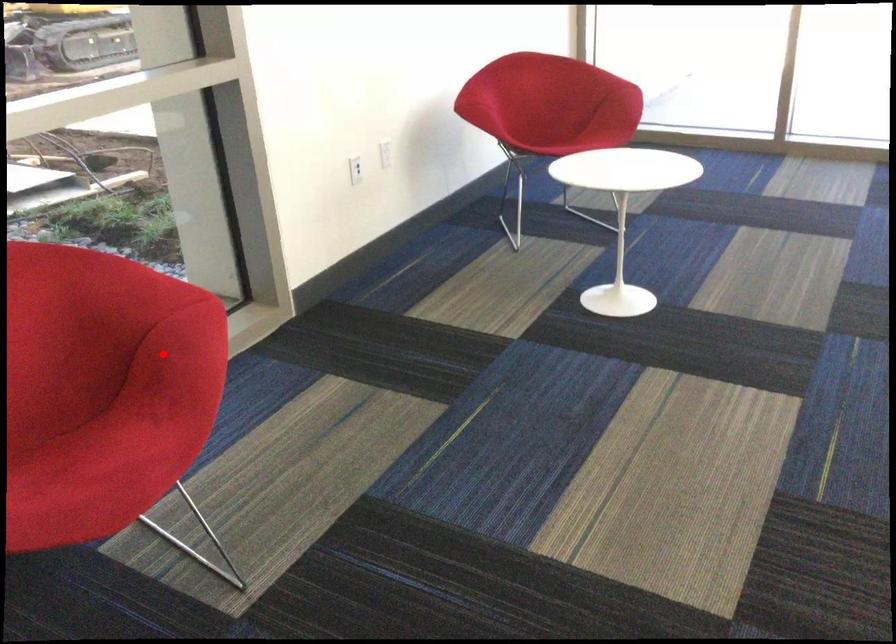
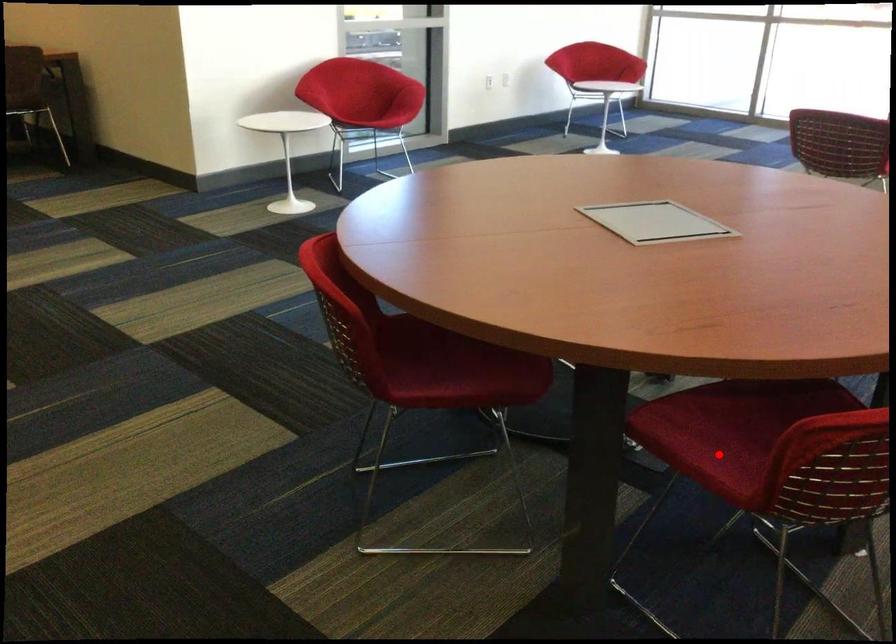
I am providing you with two images of the same scene from different viewpoints. A red point is marked on the first image and another point is marked on the second image. Is the red point in image1 aligned with the point shown in image2?

No